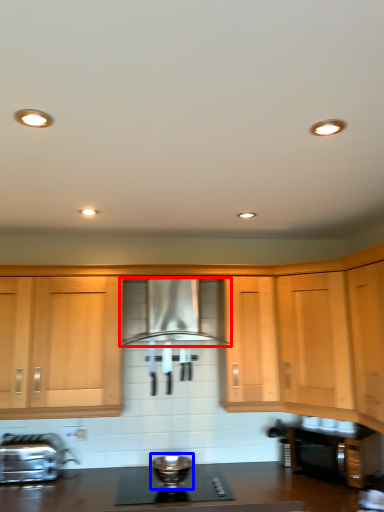
Question: Which point is closer to the camera, home appliance (highlighted by a red box) or appliance (highlighted by a blue box)?

Choices:
 (A) home appliance
 (B) appliance

Answer: (B)